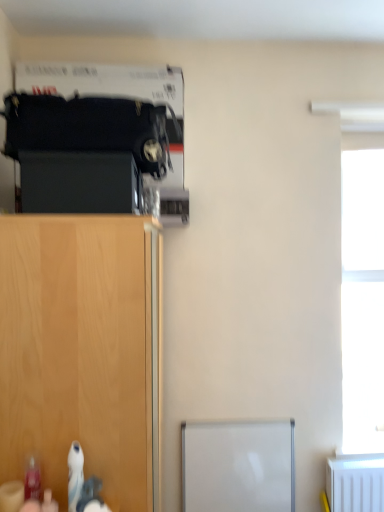
Locate an element on the screen. Image resolution: width=384 pixels, height=512 pixels. black matte cabinet at left is located at coordinates (80, 183).

Describe the element at coordinates (80, 183) in the screenshot. This screenshot has height=512, width=384. I see `black matte cabinet at left` at that location.

This screenshot has height=512, width=384. What are the coordinates of `transparent glass window at right` in the screenshot? It's located at (363, 293).

At what (x,y) coordinates should I click in order to perform the action: click on black matte cabinet at left. Please return your answer as a coordinate pair (x, y). Looking at the image, I should click on (80, 183).

Is black matte cabinet at left positioned with its back to transparent glass window at right?

No.

Where is `cabinetry lying on the left of transparent glass window at right`? The height and width of the screenshot is (512, 384). cabinetry lying on the left of transparent glass window at right is located at coordinates (80, 183).

Considering the positions of objects black matte cabinet at left and transparent glass window at right in the image provided, who is more to the right, black matte cabinet at left or transparent glass window at right?

Positioned to the right is transparent glass window at right.

Between black matte cabinet at left and transparent glass window at right, which one has larger width?

black matte cabinet at left.

Between wooden cabinet at lower left and black matte cabinet at left, which one is positioned behind?

black matte cabinet at left is further from the camera.

Is wooden cabinet at lower left bigger than black matte cabinet at left?

Yes.

Between wooden cabinet at lower left and black matte cabinet at left, which one appears on the left side from the viewer's perspective?

wooden cabinet at lower left.

The height and width of the screenshot is (512, 384). I want to click on cabinetry above the wooden cabinet at lower left (from the image's perspective), so click(x=80, y=183).

Can you confirm if wooden cabinet at lower left is shorter than transparent glass window at right?

Correct, wooden cabinet at lower left is not as tall as transparent glass window at right.

From a real-world perspective, is wooden cabinet at lower left beneath transparent glass window at right?

Correct, in the physical world, wooden cabinet at lower left is lower than transparent glass window at right.

In the scene shown: Who is more distant, wooden cabinet at lower left or transparent glass window at right?

transparent glass window at right.

What's the angular difference between transparent glass window at right and black matte cabinet at left's facing directions?

The angular difference between transparent glass window at right and black matte cabinet at left is 90.4 degrees.

From a real-world perspective, is transparent glass window at right physically located above or below black matte cabinet at left?

In terms of real-world spatial position, transparent glass window at right is below black matte cabinet at left.

Does transparent glass window at right have a greater height compared to black matte cabinet at left?

Correct, transparent glass window at right is much taller as black matte cabinet at left.

Considering the points (360, 280) and (36, 206), which point is behind, point (360, 280) or point (36, 206)?

Point (360, 280)

Consider the image. Is transparent glass window at right next to wooden cabinet at lower left and touching it?

No, transparent glass window at right is not making contact with wooden cabinet at lower left.

Is transparent glass window at right wider or thinner than wooden cabinet at lower left?

transparent glass window at right is thinner than wooden cabinet at lower left.

Which point is more distant from viewer, [356,421] or [90,268]?

Positioned behind is point [356,421].

Consider the image. Considering the positions of objects black matte cabinet at left and wooden cabinet at lower left in the image provided, who is behind, black matte cabinet at left or wooden cabinet at lower left?

black matte cabinet at left is further from the camera.

Is black matte cabinet at left not near wooden cabinet at lower left?

black matte cabinet at left is near wooden cabinet at lower left, not far away.

Looking at this image, from the image's perspective, is black matte cabinet at left above wooden cabinet at lower left?

Yes.

The width and height of the screenshot is (384, 512). I want to click on window that is behind the black matte cabinet at left, so click(x=363, y=293).

Locate an element on the screen. cupboard that appears below the black matte cabinet at left (from the image's perspective) is located at coordinates (83, 351).

Based on their spatial positions, is black matte cabinet at left or wooden cabinet at lower left closer to transparent glass window at right?

wooden cabinet at lower left lies closer to transparent glass window at right than the other object.

Looking at the image, which one is located closer to wooden cabinet at lower left, black matte cabinet at left or transparent glass window at right?

Based on the image, black matte cabinet at left appears to be nearer to wooden cabinet at lower left.

Looking at the image, which one is located closer to wooden cabinet at lower left, transparent glass window at right or black matte cabinet at left?

Based on the image, black matte cabinet at left appears to be nearer to wooden cabinet at lower left.

From the picture: Considering their positions, is wooden cabinet at lower left positioned closer to transparent glass window at right than black matte cabinet at left?

wooden cabinet at lower left is positioned closer to the anchor transparent glass window at right.

From the image, which object appears to be nearer to black matte cabinet at left, wooden cabinet at lower left or transparent glass window at right?

wooden cabinet at lower left is closer to black matte cabinet at left.

Based on their spatial positions, is transparent glass window at right or wooden cabinet at lower left further from black matte cabinet at left?

transparent glass window at right is positioned further to the anchor black matte cabinet at left.

You are a GUI agent. You are given a task and a screenshot of the screen. Output one action in this format:
    pyautogui.click(x=<x>, y=<y>)
    Task: Click on the cabinetry between wooden cabinet at lower left and transparent glass window at right from left to right
    This screenshot has width=384, height=512.
    Given the screenshot: What is the action you would take?
    pyautogui.click(x=80, y=183)